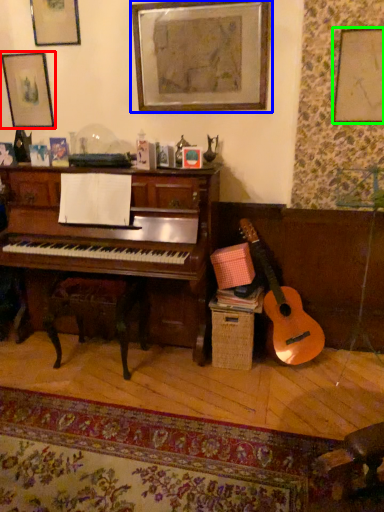
Question: Which is farther away from picture frame (highlighted by a red box)? picture frame (highlighted by a blue box) or picture frame (highlighted by a green box)?

Choices:
 (A) picture frame
 (B) picture frame

Answer: (B)